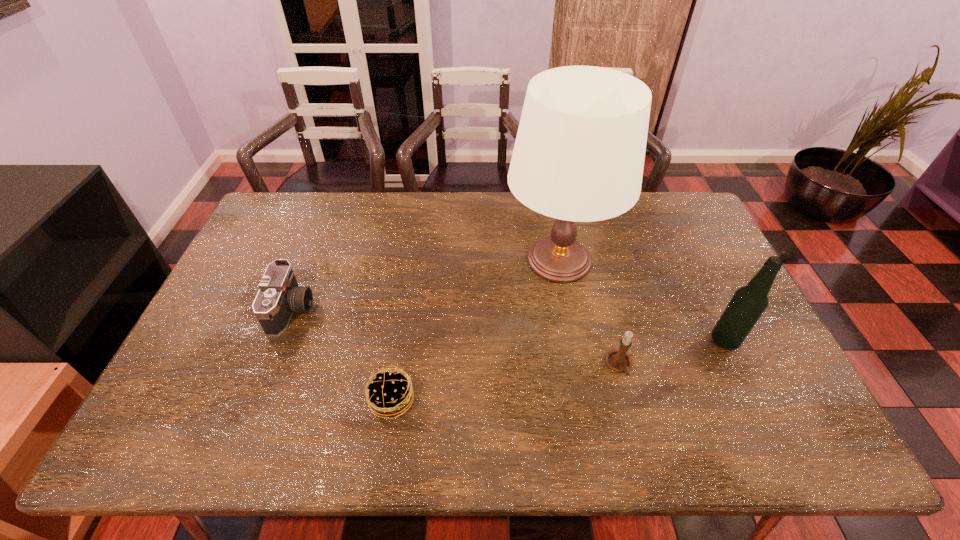
Identify the location of vacant space in between the tallest object and the fourth shortest object. (642, 300).

Where is `vacant space that's between the candle holder and the tallest object`? vacant space that's between the candle holder and the tallest object is located at coordinates (589, 313).

Image resolution: width=960 pixels, height=540 pixels. Find the location of `empty space between the lamp and the camera`. empty space between the lamp and the camera is located at coordinates (425, 285).

At what (x,y) coordinates should I click in order to perform the action: click on vacant space in between the camera and the tallest object. Please return your answer as a coordinate pair (x, y). Image resolution: width=960 pixels, height=540 pixels. Looking at the image, I should click on (425, 285).

Find the location of a particular element. The width and height of the screenshot is (960, 540). blank region between the lamp and the alcohol is located at coordinates (642, 300).

Identify the location of free space between the candle holder and the second shortest object. (456, 338).

The height and width of the screenshot is (540, 960). In order to click on free point between the fourth tallest object and the tallest object in this screenshot , I will do `click(425, 285)`.

The height and width of the screenshot is (540, 960). I want to click on blank region between the candle holder and the leftmost object, so click(456, 338).

Find the location of a particular element. Image resolution: width=960 pixels, height=540 pixels. free spot between the leftmost object and the shortest object is located at coordinates (342, 355).

Image resolution: width=960 pixels, height=540 pixels. What are the coordinates of `free spot between the fourth tallest object and the fourth shortest object` in the screenshot? It's located at (508, 325).